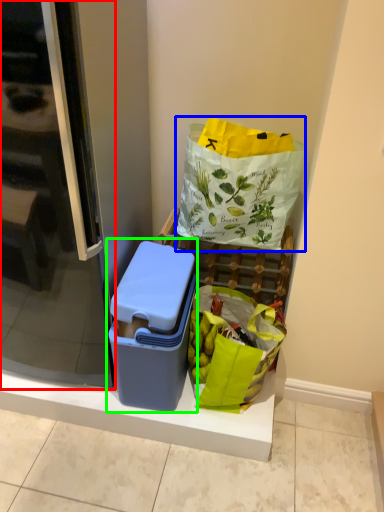
Question: Which is nearer to the screen door (highlighted by a red box)? plastic bag (highlighted by a blue box) or lunch box (highlighted by a green box).

Choices:
 (A) plastic bag
 (B) lunch box

Answer: (B)